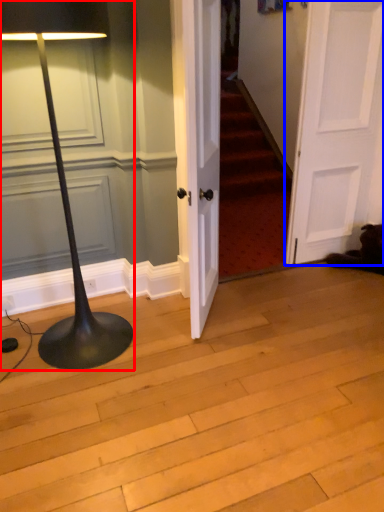
Question: Which object appears farthest to the camera in this image, lamp (highlighted by a red box) or door (highlighted by a blue box)?

Choices:
 (A) lamp
 (B) door

Answer: (B)